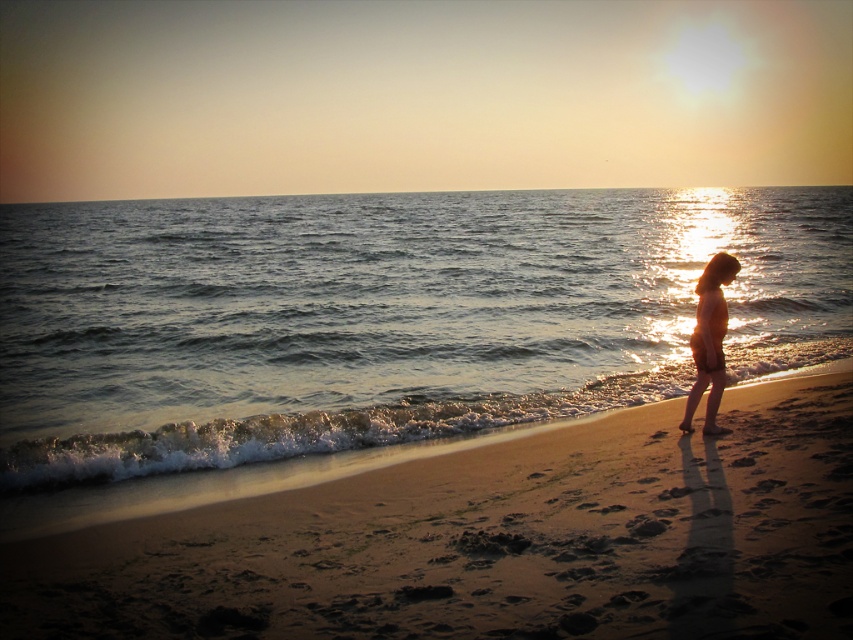
You are standing at the beach and see two points marked in the image. Point A is at coordinates point (575, 412) and Point B is at point (283, 509). Which point is closer to you?

Point A at point (575, 412) is closer to you because it is further to the viewer than point (283, 509).

Based on the photo, you are standing at the point marked as point (495, 540) on the sandy beach at lower right. You want to walk towards the person near the water edge. Which direction should you head?

The point (495, 540) is on the sandy beach at lower right. The person is near the water edge, which is towards the lower center area. Therefore, you should head towards the lower center direction to reach the person.